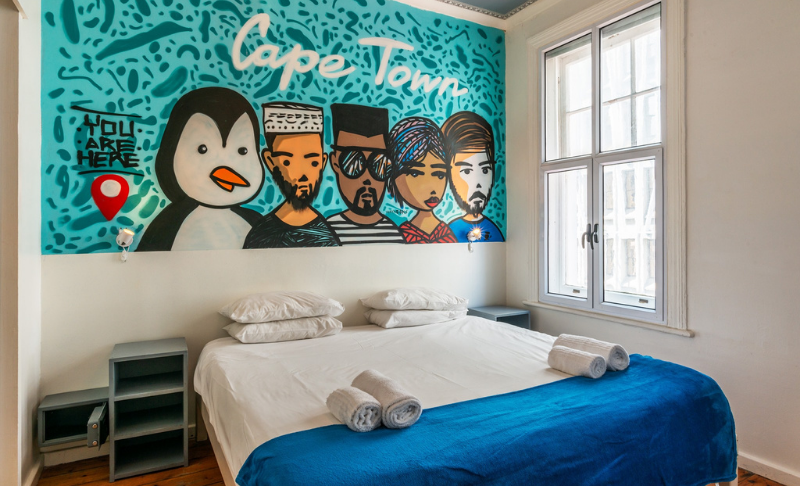
At what (x,y) coordinates should I click in order to perform the action: click on pillow. Please return your answer as a coordinate pair (x, y). Image resolution: width=800 pixels, height=486 pixels. Looking at the image, I should click on [x=400, y=318].